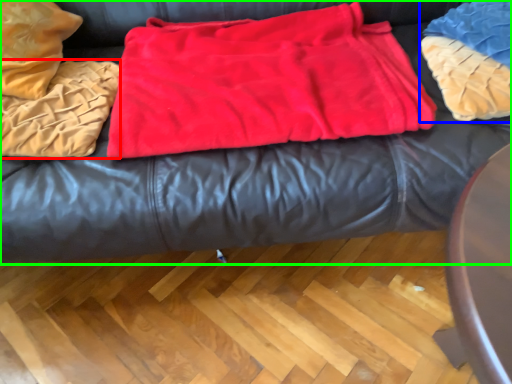
Question: Which object is the farthest from blanket (highlighted by a red box)? Choose among these: cloth (highlighted by a blue box) or furniture (highlighted by a green box).

Choices:
 (A) cloth
 (B) furniture

Answer: (A)